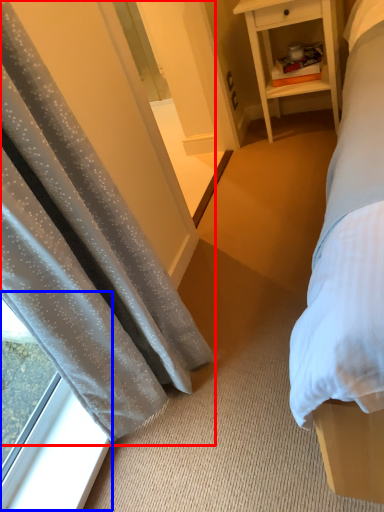
Question: Among these objects, which one is nearest to the camera, curtain (highlighted by a red box) or window (highlighted by a blue box)?

Choices:
 (A) curtain
 (B) window

Answer: (A)